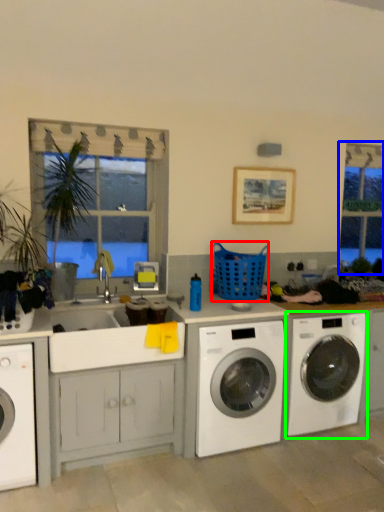
Question: Based on their relative distances, which object is farther from basket (highlighted by a red box)? Choose from bay window (highlighted by a blue box) and washing machine (highlighted by a green box).

Choices:
 (A) bay window
 (B) washing machine

Answer: (A)